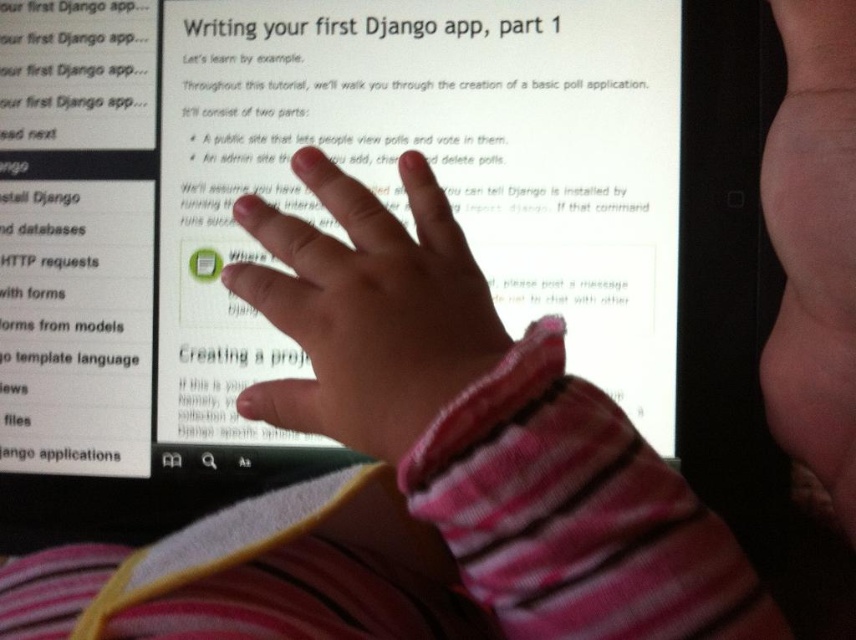
Question: Is pink fabric hand at center closer to the viewer compared to pink fabric hand at upper right?

Choices:
 (A) no
 (B) yes

Answer: (B)

Question: Which of the following is the farthest from the observer?

Choices:
 (A) (336, 410)
 (B) (789, 381)

Answer: (B)

Question: Which object appears closest to the camera in this image?

Choices:
 (A) pink fabric hand at upper right
 (B) pink fabric hand at center

Answer: (B)

Question: Is pink fabric hand at center closer to camera compared to pink fabric hand at upper right?

Choices:
 (A) yes
 (B) no

Answer: (A)

Question: Is pink fabric hand at center below pink fabric hand at upper right?

Choices:
 (A) no
 (B) yes

Answer: (B)